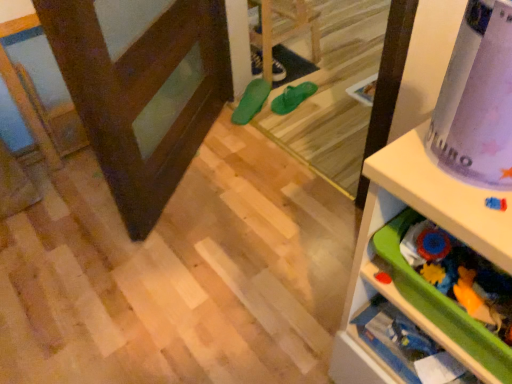
Question: Does green rubber shoe at center, the first footwear when ordered from front to back, touch dark brown wood screen door at left?

Choices:
 (A) no
 (B) yes

Answer: (A)

Question: Considering the relative sizes of green rubber shoe at center, which appears as the third footwear when viewed from the back, and dark brown wood screen door at left in the image provided, is green rubber shoe at center, which appears as the third footwear when viewed from the back, taller than dark brown wood screen door at left?

Choices:
 (A) no
 (B) yes

Answer: (A)

Question: From a real-world perspective, does green rubber shoe at center, which appears as the third footwear when viewed from the back, sit lower than dark brown wood screen door at left?

Choices:
 (A) yes
 (B) no

Answer: (A)

Question: Is green rubber shoe at center, the first footwear when ordered from front to back, positioned behind dark brown wood screen door at left?

Choices:
 (A) no
 (B) yes

Answer: (B)

Question: Can you confirm if green rubber shoe at center, the first footwear when ordered from front to back, is bigger than dark brown wood screen door at left?

Choices:
 (A) yes
 (B) no

Answer: (B)

Question: Is green rubber shoe at center, the first footwear when ordered from front to back, wider or thinner than purple matte wrapping paper at upper right?

Choices:
 (A) thin
 (B) wide

Answer: (B)

Question: Considering their positions, is green rubber shoe at center, the first footwear when ordered from front to back, located in front of or behind purple matte wrapping paper at upper right?

Choices:
 (A) front
 (B) behind

Answer: (B)

Question: Is point (230, 117) closer or farther from the camera than point (462, 102)?

Choices:
 (A) farther
 (B) closer

Answer: (A)

Question: Is green rubber shoe at center, the first footwear when ordered from front to back, to the left or to the right of purple matte wrapping paper at upper right in the image?

Choices:
 (A) left
 (B) right

Answer: (A)

Question: From a real-world perspective, is dark brown wood screen door at left above or below green plastic drawer at lower right, which is counted as the 2th shelf, starting from the front?

Choices:
 (A) below
 (B) above

Answer: (A)

Question: From the image's perspective, relative to green plastic drawer at lower right, which is counted as the 2th shelf, starting from the front, is dark brown wood screen door at left above or below?

Choices:
 (A) above
 (B) below

Answer: (A)

Question: Looking at the image, does dark brown wood screen door at left seem bigger or smaller compared to green plastic drawer at lower right, which appears as the 1th shelf when viewed from the back?

Choices:
 (A) small
 (B) big

Answer: (B)

Question: Based on their positions, is dark brown wood screen door at left located to the left or right of green plastic drawer at lower right, which is counted as the 2th shelf, starting from the front?

Choices:
 (A) right
 (B) left

Answer: (B)

Question: Would you say purple matte wrapping paper at upper right is to the left or to the right of green rubber flip-flops at center in the picture?

Choices:
 (A) right
 (B) left

Answer: (A)

Question: Is purple matte wrapping paper at upper right inside the boundaries of green rubber flip-flops at center, or outside?

Choices:
 (A) outside
 (B) inside

Answer: (A)